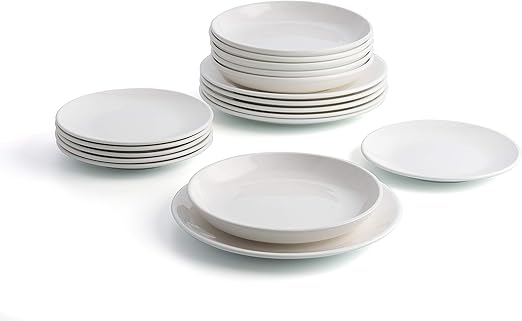
The height and width of the screenshot is (321, 522). Find the location of `bowl`. bowl is located at coordinates (322, 51), (324, 58), (321, 65), (320, 74), (320, 80), (289, 195).